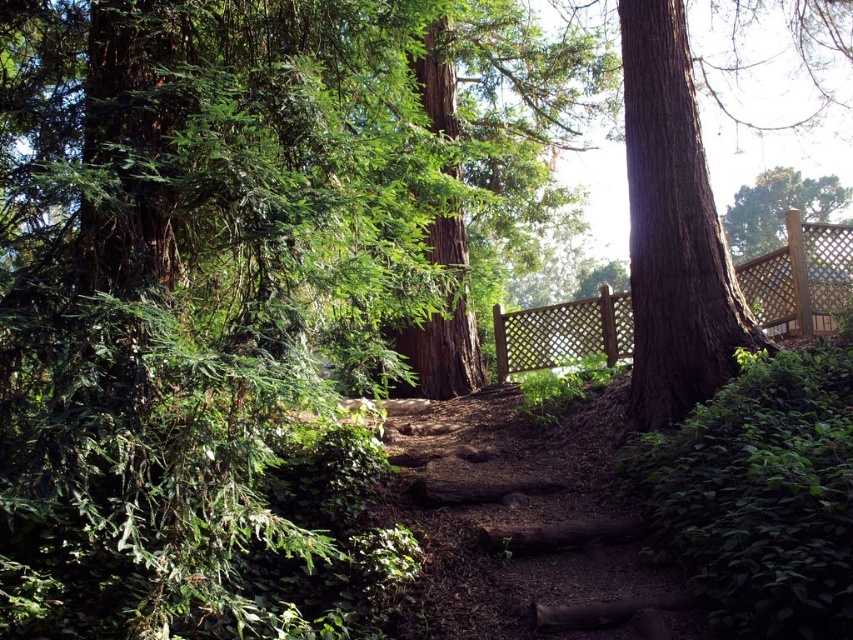
You are a painter setting up your easel to capture the forest scene. You want to paint both the smooth brown tree trunk at right and the wooden lattice fence at right. Which object should you move closer to if you want to depict the thinner one in your painting?

The smooth brown tree trunk at right is thinner than the wooden lattice fence at right, so you should move closer to the smooth brown tree trunk at right to depict the thinner one in your painting.

You are a painter setting up your easel to capture the forest scene. You want to ensure both the smooth brown tree trunk at right and the wooden lattice fence at right are visible in your painting. Given their sizes, which object should you position closer to the center to emphasize its prominence?

The smooth brown tree trunk at right is bigger than the wooden lattice fence at right, so positioning the smooth brown tree trunk at right closer to the center will emphasize its prominence due to its larger size.